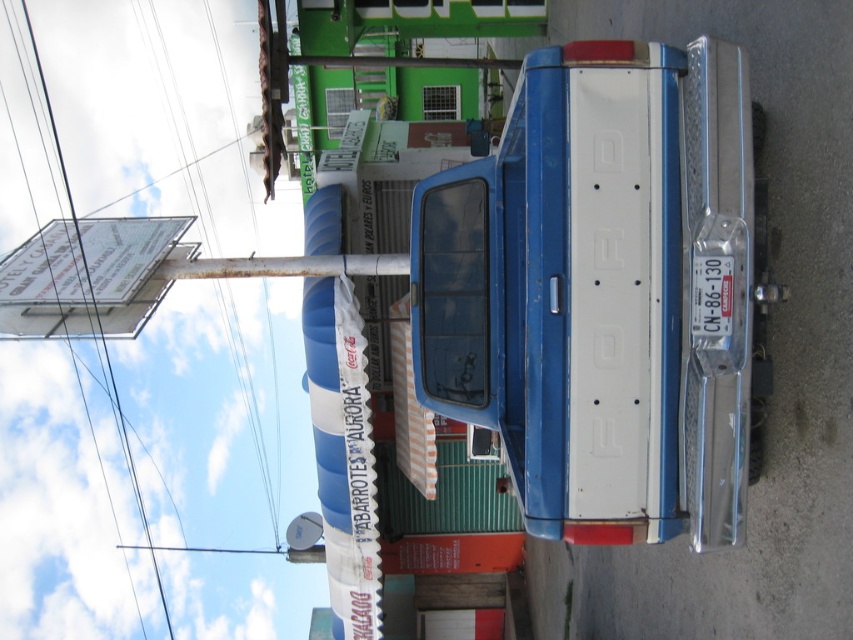
Looking at this image, you are a delivery person trying to secure a package to the bed of the vintage Ford pickup truck. You have two wires available for this task. The white wire at upper left and the metallic wire at upper left. Which wire should you choose to ensure the package stays secure?

The metallic wire at upper left should be chosen because it has a greater width than the white wire at upper left, providing more strength for securing the package.

You are a delivery driver who needs to back up the blue metallic truck at center into a loading bay. There is a white wire at upper left that you must avoid. Based on their positions, can you safely back up the truck without hitting the wire?

The blue metallic truck at center is in front of the white wire at upper left, meaning the wire is behind the truck. Since the wire is behind the truck, backing up would bring the truck closer to the wire. However, the exact distance isn not provided, so it is uncertain if there is enough space. To ensure safety, the driver should check the distance between the truck and the wire before backing up.

You are a delivery driver who needs to park your vehicle in this area. The blue metallic truck at center and the white wire at upper left are present. Which object should you be cautious of when backing up your vehicle to avoid collision?

The blue metallic truck at center is smaller in size compared to the white wire at upper left, so you should be cautious of the white wire at upper left when backing up to avoid collision since it might be taller or extend further out.